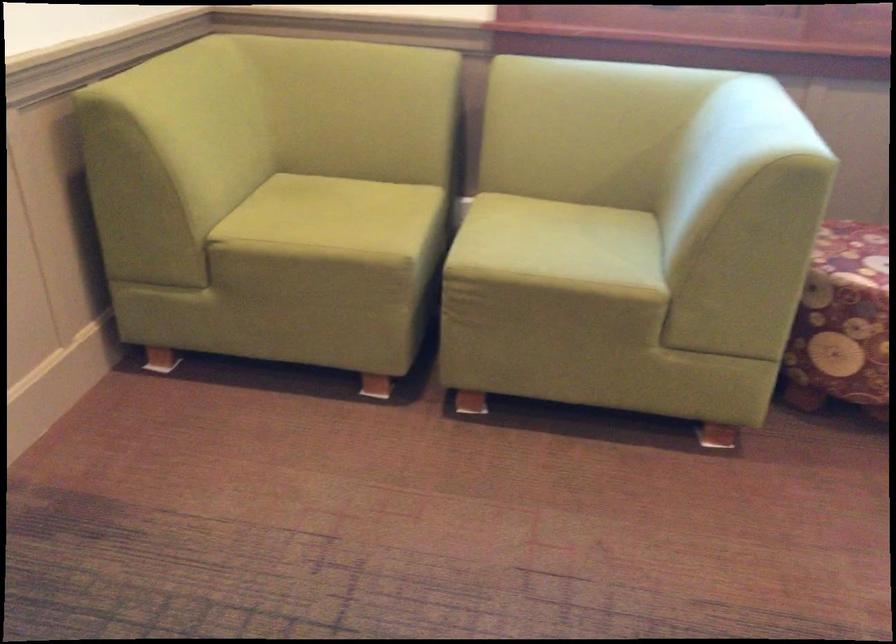
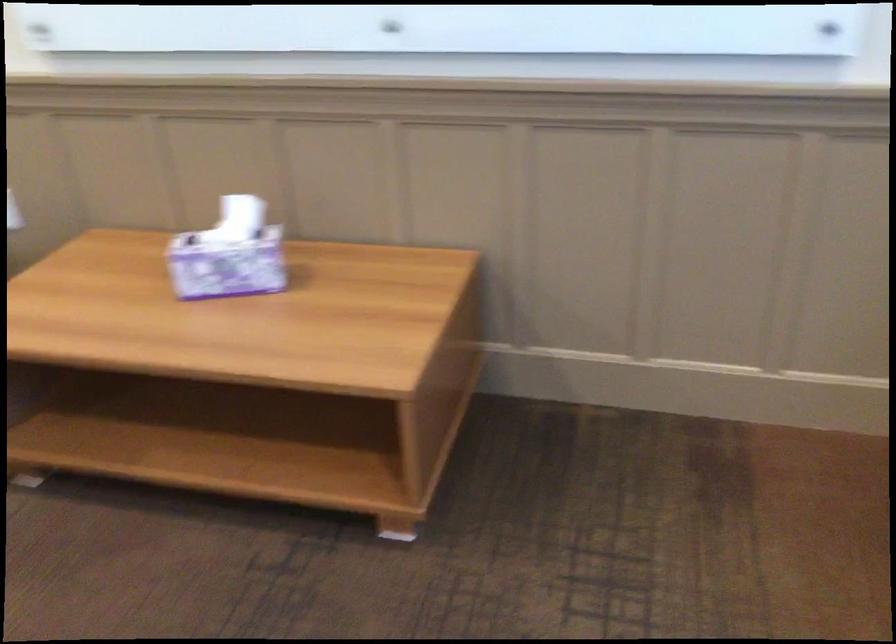
Based on the continuous images, in which direction is the camera rotating?

The camera's rotation is toward left-down.